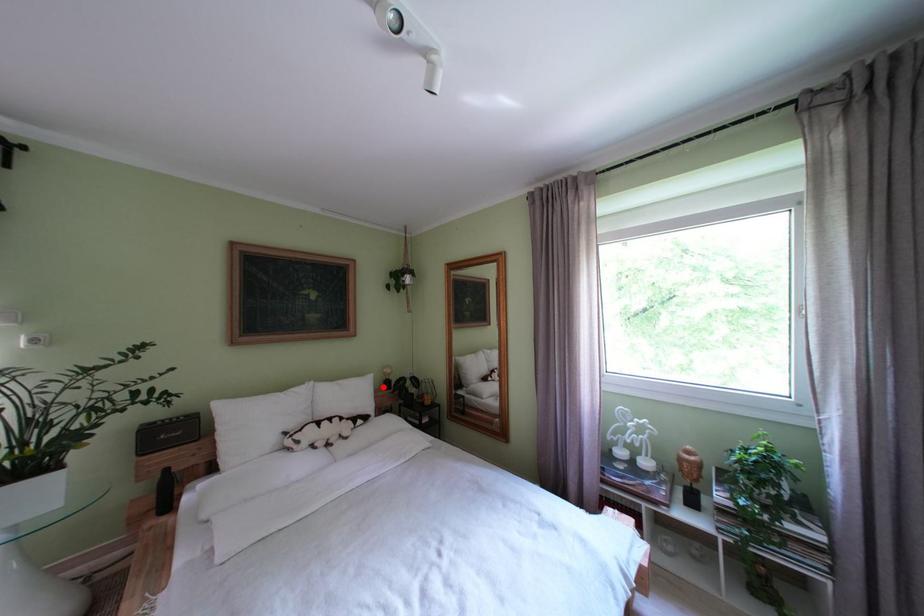
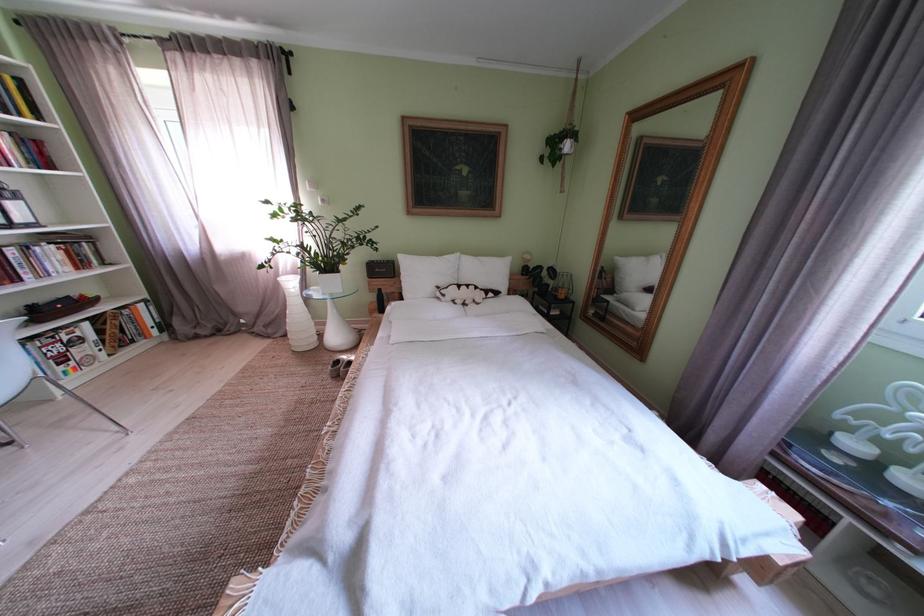
Question: I am providing you with two images of the same scene from different viewpoints. A red point is shown in image1. For the corresponding object point in image2, is it positioned nearer or farther from the camera?

Choices:
 (A) Nearer
 (B) Farther

Answer: (A)